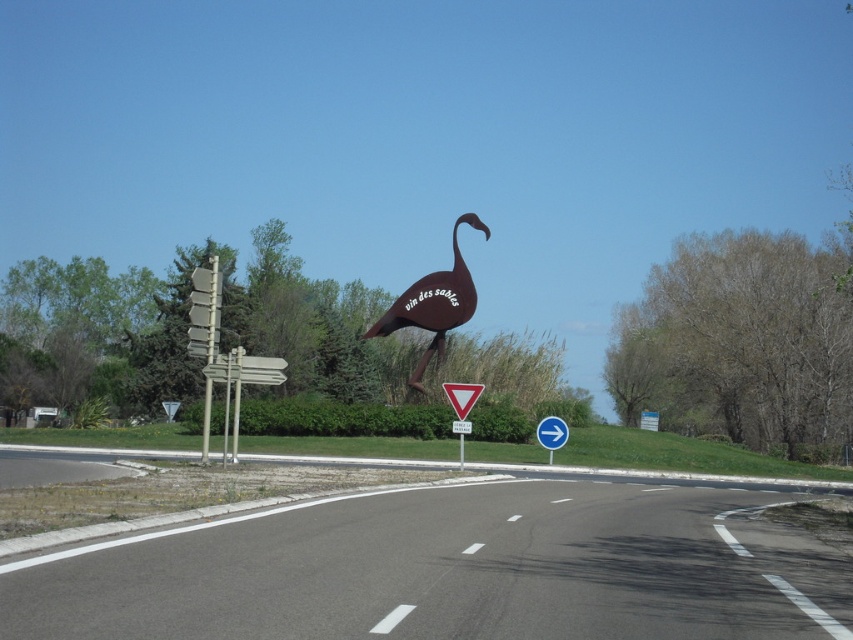
In the scene shown: Which of these two, black asphalt road at lower center or white plastic arrow at center right, stands shorter?

Standing shorter between the two is white plastic arrow at center right.

You are a GUI agent. You are given a task and a screenshot of the screen. Output one action in this format:
    pyautogui.click(x=<x>, y=<y>)
    Task: Click on the black asphalt road at lower center
    The image size is (853, 640).
    Given the screenshot: What is the action you would take?
    pyautogui.click(x=450, y=570)

Is metal triangular sign at center smaller than white plastic arrow at center right?

No, metal triangular sign at center is not smaller than white plastic arrow at center right.

Between metal triangular sign at center and white plastic arrow at center right, which one appears on the left side from the viewer's perspective?

metal triangular sign at center is more to the left.

Image resolution: width=853 pixels, height=640 pixels. I want to click on metal triangular sign at center, so click(462, 396).

Find the location of a particular element. metal triangular sign at center is located at coordinates (462, 396).

Is white plastic arrow at center right closer to the viewer compared to brushed metal triangle at center?

No.

Who is more forward, (537, 440) or (469, 422)?

Point (469, 422)

Find the location of a particular element. The image size is (853, 640). white plastic arrow at center right is located at coordinates (550, 433).